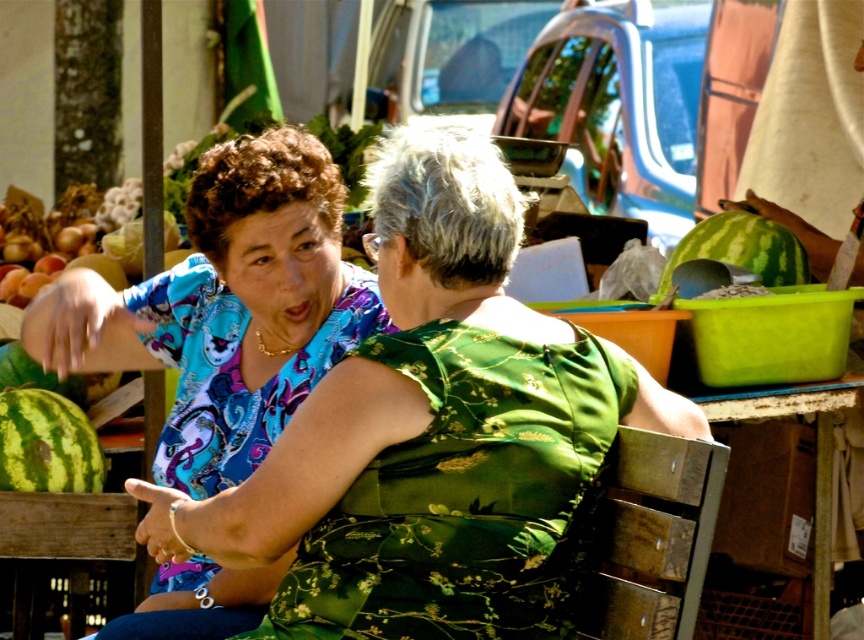
Is blue paisley fabric dress at upper left wider than green matte watermelon at lower left?

Indeed, blue paisley fabric dress at upper left has a greater width compared to green matte watermelon at lower left.

Does point (167, 436) lie in front of point (14, 387)?

Yes, it is in front of point (14, 387).

Between point (227, 456) and point (40, 371), which one is positioned behind?

Positioned behind is point (40, 371).

Identify the location of blue paisley fabric dress at upper left. (233, 371).

Who is positioned more to the left, blue paisley blouse at upper left or green striped watermelon at right?

blue paisley blouse at upper left is more to the left.

Does point (321, 262) come closer to viewer compared to point (789, 232)?

Yes, point (321, 262) is closer to viewer.

You are a GUI agent. You are given a task and a screenshot of the screen. Output one action in this format:
    pyautogui.click(x=<x>, y=<y>)
    Task: Click on the blue paisley blouse at upper left
    
    Given the screenshot: What is the action you would take?
    pyautogui.click(x=226, y=308)

Does matte blue blouse at center come in front of blue paisley blouse at upper left?

Yes, it is in front of blue paisley blouse at upper left.

Is point (655, 381) positioned after point (62, 301)?

Yes, it is behind point (62, 301).

Identify the location of matte blue blouse at center. (432, 435).